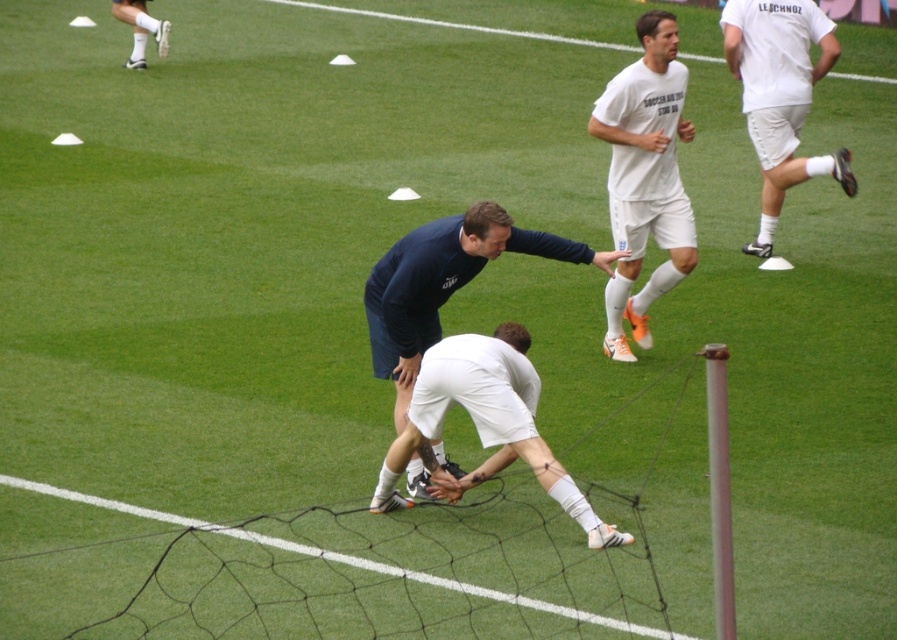
Between dark blue fabric shirt at center and white matte socks at upper left, which one is positioned lower?

Positioned lower is dark blue fabric shirt at center.

Which is above, dark blue fabric shirt at center or white matte socks at upper left?

white matte socks at upper left

Where is `dark blue fabric shirt at center`? The height and width of the screenshot is (640, 897). dark blue fabric shirt at center is located at coordinates (425, 284).

In order to click on dark blue fabric shirt at center in this screenshot , I will do `click(425, 284)`.

Is white matte shorts at center in front of white matte shorts at right?

That is True.

What do you see at coordinates (645, 177) in the screenshot?
I see `white matte shorts at center` at bounding box center [645, 177].

At what (x,y) coordinates should I click in order to perform the action: click on white matte shorts at center. Please return your answer as a coordinate pair (x, y). The image size is (897, 640). Looking at the image, I should click on (645, 177).

Is white matte shorts at center below white matte socks at upper left?

Correct, white matte shorts at center is located below white matte socks at upper left.

Identify the location of white matte shorts at center. Image resolution: width=897 pixels, height=640 pixels. (645, 177).

The width and height of the screenshot is (897, 640). In order to click on white matte shorts at center in this screenshot , I will do `click(645, 177)`.